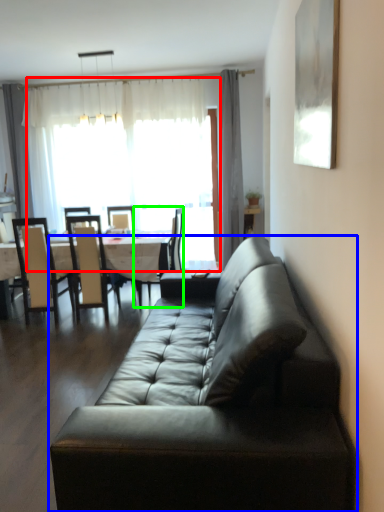
Question: Based on their relative distances, which object is farther from window screen (highlighted by a red box)? Choose from studio couch (highlighted by a blue box) and chair (highlighted by a green box).

Choices:
 (A) studio couch
 (B) chair

Answer: (A)